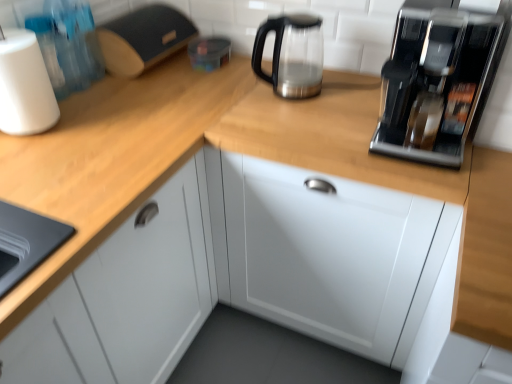
I want to click on free area behind sleek metallic coffee machine at upper right, so click(x=356, y=94).